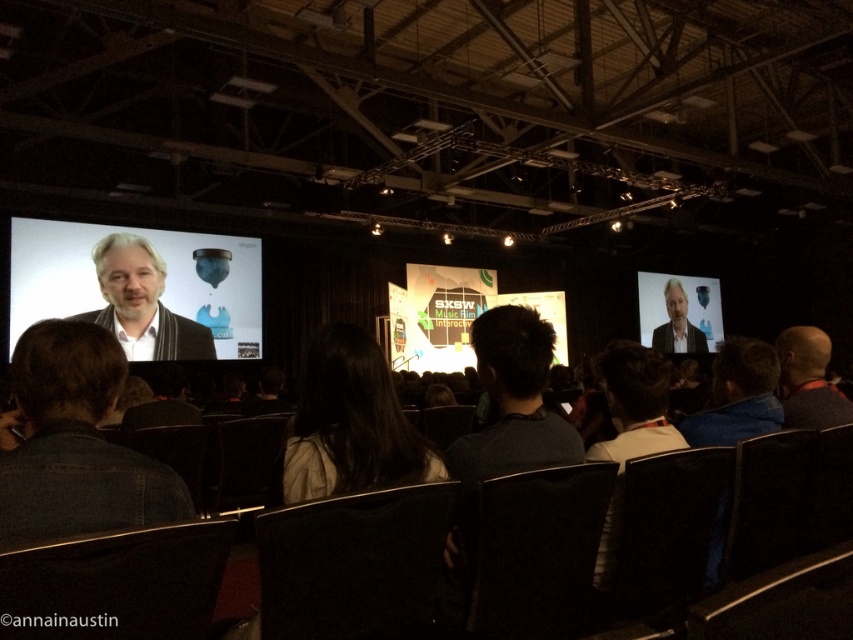
Question: Among these objects, which one is nearest to the camera?

Choices:
 (A) light brown hair at left
 (B) dark gray jacket at lower left

Answer: (B)

Question: Does dark gray jacket at lower left appear over dark hair at center?

Choices:
 (A) yes
 (B) no

Answer: (A)

Question: Is dark hair at center closer to camera compared to light brown hair at right?

Choices:
 (A) no
 (B) yes

Answer: (B)

Question: Estimate the real-world distances between objects in this image. Which object is closer to the light brown hair at right?

Choices:
 (A) light brown hair at left
 (B) dark gray jacket at lower left
 (C) bald head at right
 (D) dark gray shirt at center

Answer: (A)

Question: Can you confirm if dark gray shirt at center is wider than dark blue shirt at lower right?

Choices:
 (A) yes
 (B) no

Answer: (B)

Question: Which of the following is the closest to the observer?

Choices:
 (A) light brown hair at right
 (B) dark gray jacket at lower left
 (C) light brown hair at left

Answer: (B)